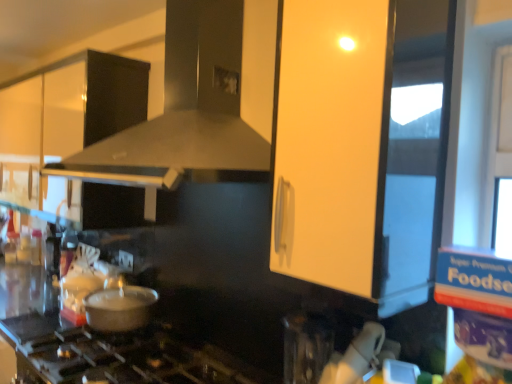
Describe the element at coordinates (360, 146) in the screenshot. I see `matte white cabinet at upper center` at that location.

What is the approximate height of metallic silver pot at lower left?

The height of metallic silver pot at lower left is 6.05 inches.

The image size is (512, 384). What do you see at coordinates (120, 308) in the screenshot?
I see `metallic silver pot at lower left` at bounding box center [120, 308].

You are a GUI agent. You are given a task and a screenshot of the screen. Output one action in this format:
    pyautogui.click(x=<x>, y=<y>)
    Task: Click on the white glossy cabinet at upper left
    The image size is (512, 384).
    Given the screenshot: What is the action you would take?
    pyautogui.click(x=70, y=107)

Looking at this image, would you say black matte gas stove at lower center is a long distance from matte white cabinet at upper center?

They are positioned close to each other.

Between black matte gas stove at lower center and matte white cabinet at upper center, which one has larger size?

Bigger between the two is black matte gas stove at lower center.

Image resolution: width=512 pixels, height=384 pixels. What are the coordinates of `gas stove behind the matte white cabinet at upper center` in the screenshot? It's located at pos(114,356).

Is black matte gas stove at lower center spatially inside matte white cabinet at upper center, or outside of it?

black matte gas stove at lower center is spatially situated outside matte white cabinet at upper center.

Looking at this image, from the image's perspective, between matte black vent at center and white glossy cabinet at upper left, who is located below?

white glossy cabinet at upper left appears lower in the image.

Considering the sizes of objects matte black vent at center and white glossy cabinet at upper left in the image provided, who is wider, matte black vent at center or white glossy cabinet at upper left?

With larger width is matte black vent at center.

How much distance is there between matte black vent at center and white glossy cabinet at upper left?

A distance of 27.19 inches exists between matte black vent at center and white glossy cabinet at upper left.

Between point (211, 47) and point (55, 98), which one is positioned in front?

The point (211, 47) is closer.

Is metallic silver pot at lower left facing away from matte black vent at center?

metallic silver pot at lower left does not have its back to matte black vent at center.

Is metallic silver pot at lower left bigger than matte black vent at center?

Incorrect, metallic silver pot at lower left is not larger than matte black vent at center.

Would you say metallic silver pot at lower left is inside or outside matte black vent at center?

metallic silver pot at lower left is outside matte black vent at center.

Does metallic silver pot at lower left come behind matte black vent at center?

That is True.

Is metallic silver pot at lower left aimed at white glossy cabinet at upper left?

No.

Does metallic silver pot at lower left come behind white glossy cabinet at upper left?

That is False.

From a real-world perspective, is metallic silver pot at lower left physically located above or below white glossy cabinet at upper left?

metallic silver pot at lower left is below white glossy cabinet at upper left.

Is metallic silver pot at lower left in contact with white glossy cabinet at upper left?

No, metallic silver pot at lower left is not in contact with white glossy cabinet at upper left.

Is point (116, 118) positioned in front of point (142, 308)?

No, it is not.

From a real-world perspective, is white glossy cabinet at upper left on metallic silver pot at lower left?

Yes.

Is there a large distance between white glossy cabinet at upper left and metallic silver pot at lower left?

That's not correct — white glossy cabinet at upper left is a little close to metallic silver pot at lower left.

Is metallic silver pot at lower left located within matte black vent at center?

Definitely not — metallic silver pot at lower left is not inside matte black vent at center.

Does point (100, 161) come farther from viewer compared to point (125, 288)?

No, (100, 161) is in front of (125, 288).

Is the position of matte black vent at center more distant than that of metallic silver pot at lower left?

No, the depth of matte black vent at center is less than that of metallic silver pot at lower left.

Between matte white cabinet at upper center and matte black vent at center, which one has smaller width?

matte white cabinet at upper center is thinner.

Is matte white cabinet at upper center further to the viewer compared to matte black vent at center?

No, it is in front of matte black vent at center.

Considering the relative positions of matte white cabinet at upper center and matte black vent at center in the image provided, is matte white cabinet at upper center to the left or to the right of matte black vent at center?

In the image, matte white cabinet at upper center appears on the right side of matte black vent at center.

Identify the location of gas stove below the matte white cabinet at upper center (from the image's perspective). This screenshot has width=512, height=384. (114, 356).

The image size is (512, 384). In order to click on cabinetry on the left of matte black vent at center in this screenshot , I will do `click(70, 107)`.

From the image, which object appears to be nearer to metallic silver pot at lower left, matte black vent at center or black matte gas stove at lower center?

The object closer to metallic silver pot at lower left is black matte gas stove at lower center.

Estimate the real-world distances between objects in this image. Which object is closer to matte white cabinet at upper center, matte black vent at center or metallic silver pot at lower left?

The object closer to matte white cabinet at upper center is matte black vent at center.

Estimate the real-world distances between objects in this image. Which object is closer to matte white cabinet at upper center, white glossy cabinet at upper left or metallic silver pot at lower left?

metallic silver pot at lower left.

When comparing their distances from white glossy cabinet at upper left, does black matte gas stove at lower center or matte white cabinet at upper center seem closer?

Based on the image, black matte gas stove at lower center appears to be nearer to white glossy cabinet at upper left.

From the image, which object appears to be nearer to matte white cabinet at upper center, black matte gas stove at lower center or matte black vent at center?

Based on the image, matte black vent at center appears to be nearer to matte white cabinet at upper center.

From the image, which object appears to be nearer to black matte gas stove at lower center, metallic silver pot at lower left or matte black vent at center?

Based on the image, metallic silver pot at lower left appears to be nearer to black matte gas stove at lower center.

Estimate the real-world distances between objects in this image. Which object is closer to white glossy cabinet at upper left, metallic silver pot at lower left or black matte gas stove at lower center?

Among the two, metallic silver pot at lower left is located nearer to white glossy cabinet at upper left.

Estimate the real-world distances between objects in this image. Which object is further from white glossy cabinet at upper left, matte black vent at center or metallic silver pot at lower left?

metallic silver pot at lower left is positioned further to the anchor white glossy cabinet at upper left.

Where is `kitchen appliance between white glossy cabinet at upper left and black matte gas stove at lower center from top to bottom`? kitchen appliance between white glossy cabinet at upper left and black matte gas stove at lower center from top to bottom is located at coordinates (120, 308).

The width and height of the screenshot is (512, 384). In order to click on vent between white glossy cabinet at upper left and matte white cabinet at upper center from left to right in this screenshot , I will do `click(186, 112)`.

You are a GUI agent. You are given a task and a screenshot of the screen. Output one action in this format:
    pyautogui.click(x=<x>, y=<y>)
    Task: Click on the kitchen appliance between white glossy cabinet at upper left and matte white cabinet at upper center in the horizontal direction
    The height and width of the screenshot is (384, 512).
    Given the screenshot: What is the action you would take?
    pyautogui.click(x=120, y=308)

You are a GUI agent. You are given a task and a screenshot of the screen. Output one action in this format:
    pyautogui.click(x=<x>, y=<y>)
    Task: Click on the cabinetry that lies between matte black vent at center and metallic silver pot at lower left from top to bottom
    Image resolution: width=512 pixels, height=384 pixels.
    Given the screenshot: What is the action you would take?
    pyautogui.click(x=70, y=107)